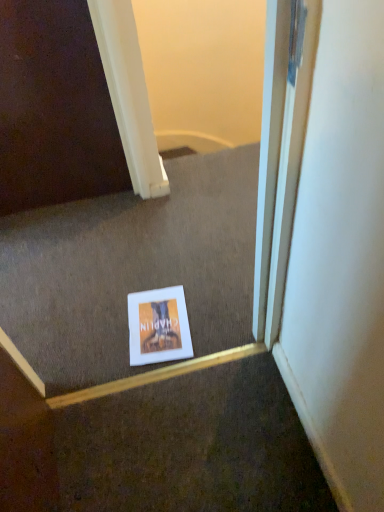
I want to click on free space behind matte cardboard book at center, so click(x=154, y=272).